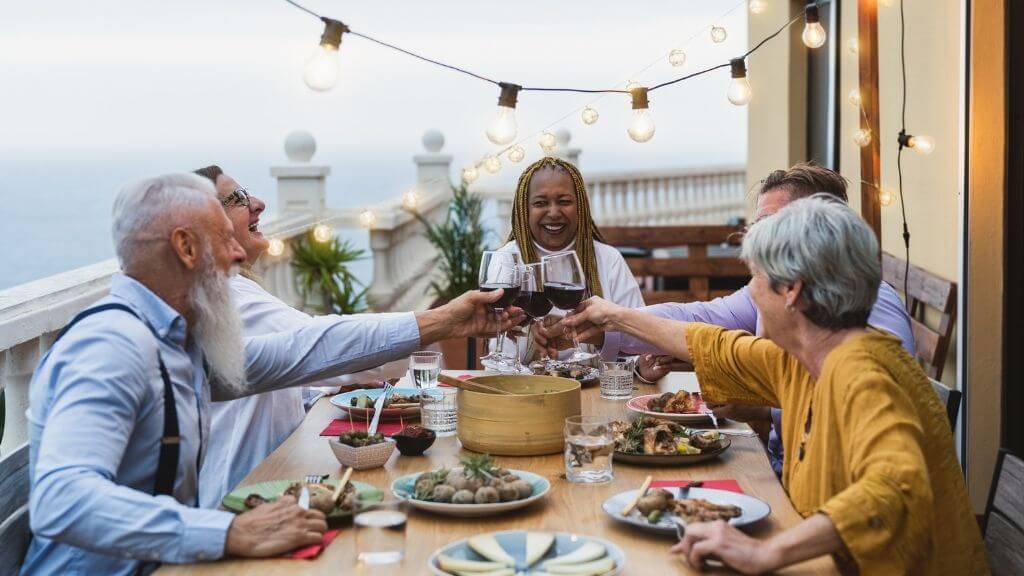
Identify the location of 4 red napkins. (311, 547), (344, 422), (460, 374), (729, 480).